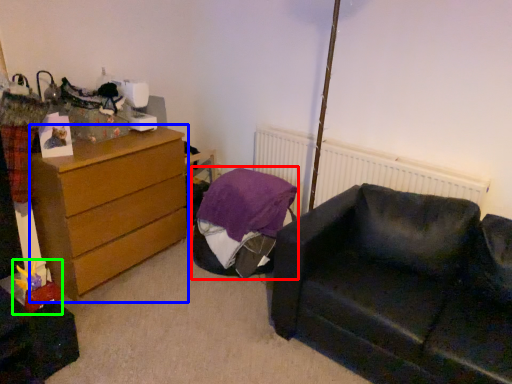
Question: Based on their relative distances, which object is nearer to bean bag chair (highlighted by a red box)? Choose from chest of drawers (highlighted by a blue box) and toy (highlighted by a green box).

Choices:
 (A) chest of drawers
 (B) toy

Answer: (A)